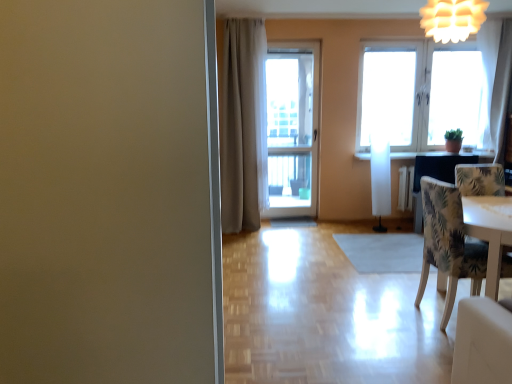
Where is `vacant area on top of white glass door at center (from a real-world perspective)`? This screenshot has width=512, height=384. vacant area on top of white glass door at center (from a real-world perspective) is located at coordinates (286, 42).